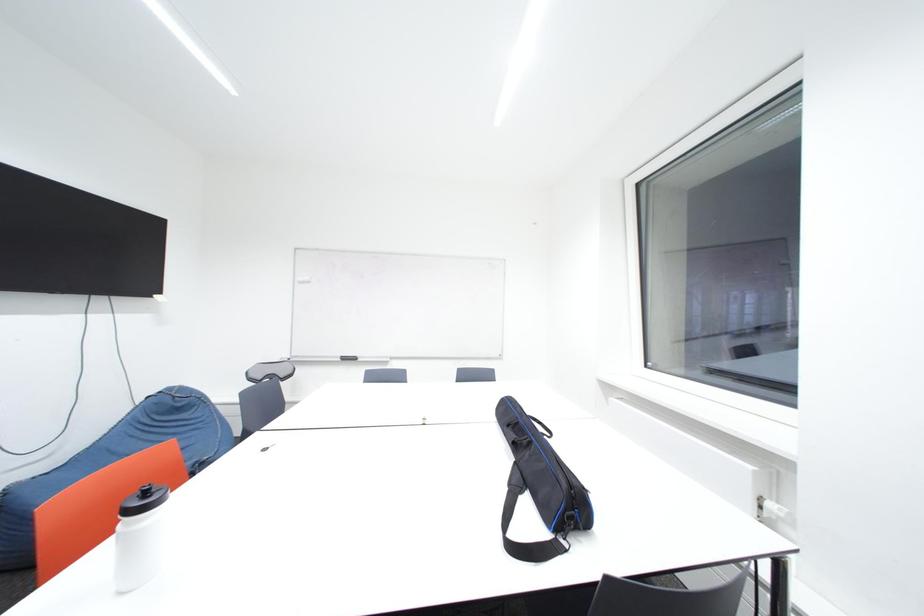
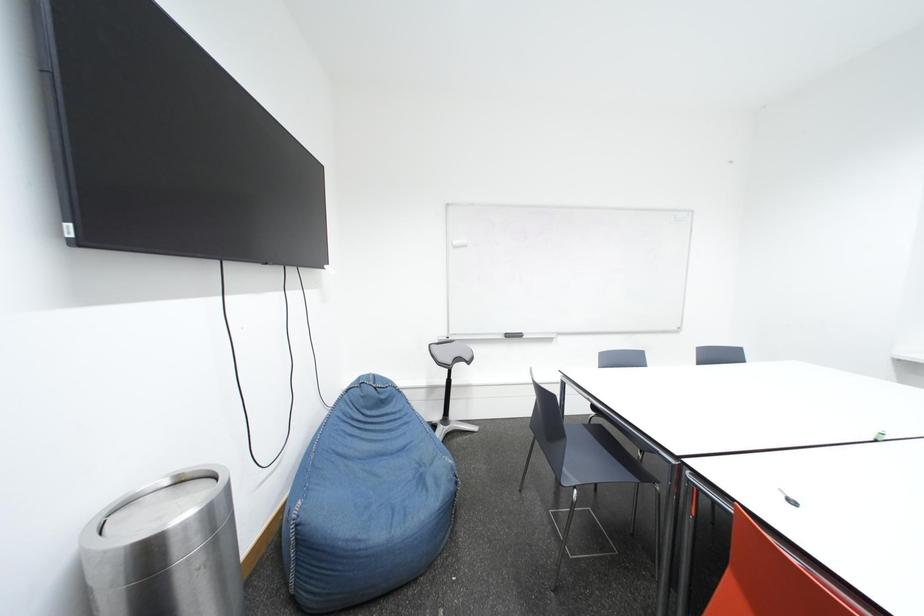
Question: What movement of the cameraman would produce the second image?

Choices:
 (A) Left
 (B) Right
 (C) Forward
 (D) Backward

Answer: (A)